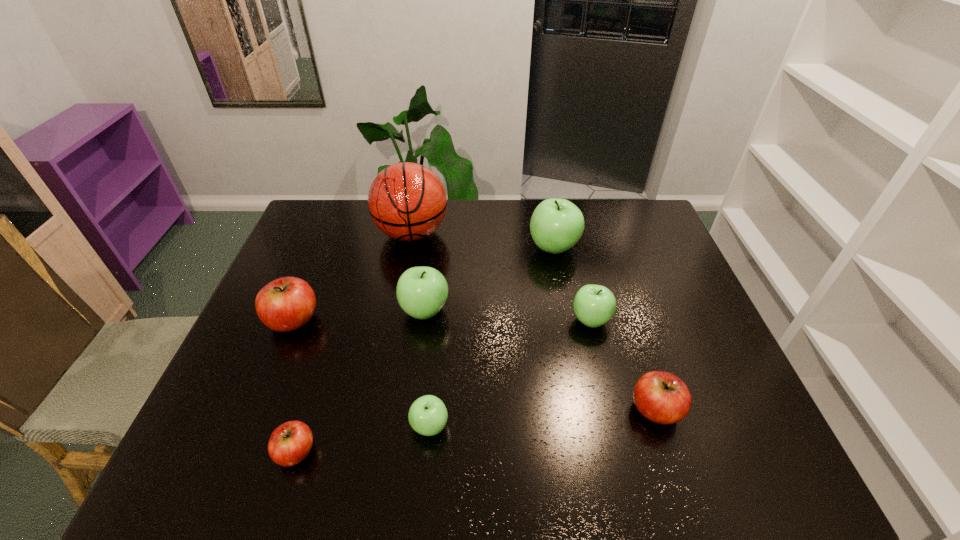
Locate an element on the screen. the smallest red apple is located at coordinates (290, 443).

Find the location of a particular element. The image size is (960, 540). free space located on the side with spill of the basketball is located at coordinates (396, 323).

You are a GUI agent. You are given a task and a screenshot of the screen. Output one action in this format:
    pyautogui.click(x=<x>, y=<y>)
    Task: Click on the free point located 0.100m on the front of the tallest apple
    This screenshot has width=960, height=540.
    Given the screenshot: What is the action you would take?
    pyautogui.click(x=562, y=286)

At what (x,y) coordinates should I click in order to perform the action: click on vacant space located on the left of the third smallest green apple. Please return your answer as a coordinate pair (x, y). This screenshot has height=540, width=960. Looking at the image, I should click on click(x=372, y=310).

This screenshot has height=540, width=960. I want to click on vacant point located 0.190m on the front of the leftmost red apple, so click(259, 404).

Locate an element on the screen. This screenshot has width=960, height=540. vacant area located 0.060m on the front of the second smallest green apple is located at coordinates pos(599,354).

Find the location of a particular element. free space located on the front of the second smallest red apple is located at coordinates (670, 455).

What are the coordinates of `free region located on the back of the smallest green apple` in the screenshot? It's located at (437, 341).

Image resolution: width=960 pixels, height=540 pixels. I want to click on vacant area situated on the right of the smallest red apple, so click(x=418, y=452).

Where is `basketball located in the far edge section of the desktop`? The width and height of the screenshot is (960, 540). basketball located in the far edge section of the desktop is located at coordinates (407, 201).